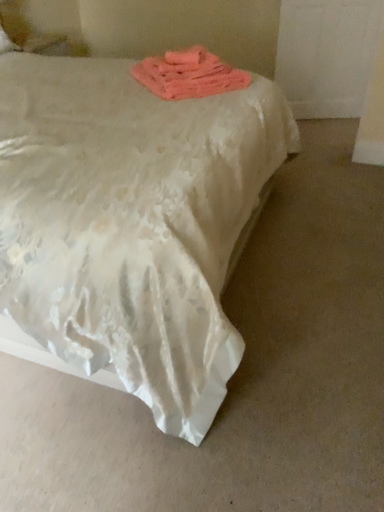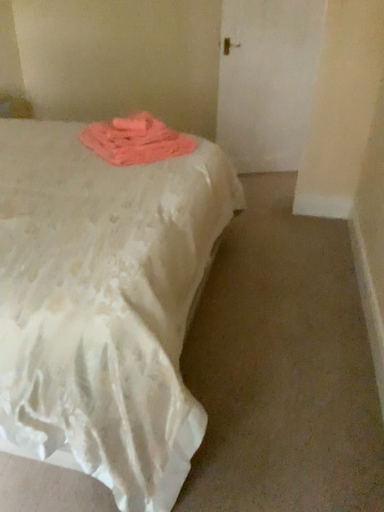
Question: Which way did the camera rotate in the video?

Choices:
 (A) rotated left
 (B) rotated right

Answer: (B)